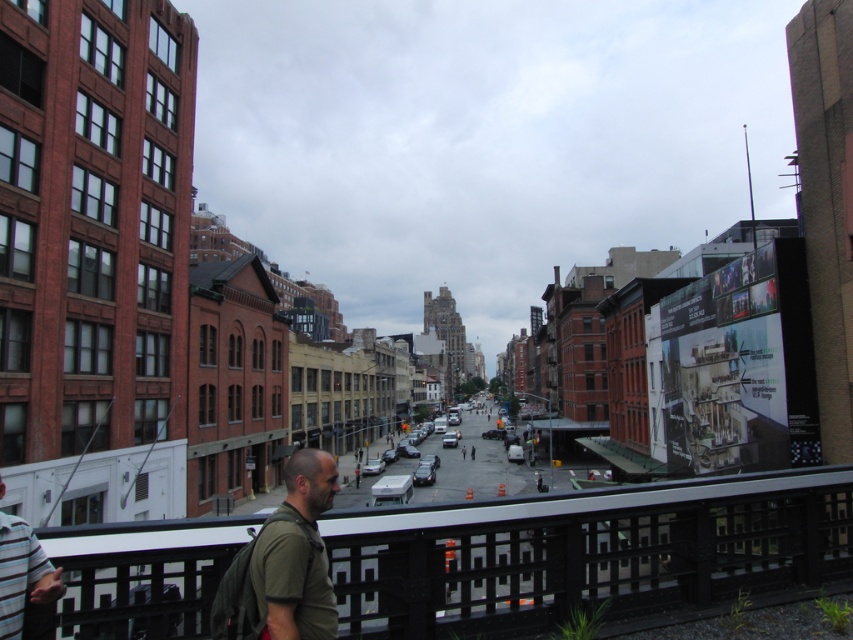
Question: Which of the following is the closest to the observer?

Choices:
 (A) (252, 518)
 (B) (59, 586)
 (C) (325, 452)

Answer: (B)

Question: Which object is positioned farthest from the black metal rail at lower center?

Choices:
 (A) green matte shirt at lower center
 (B) striped cotton shirt at lower left

Answer: (B)

Question: Does black metal rail at lower center have a smaller size compared to green matte shirt at lower center?

Choices:
 (A) no
 (B) yes

Answer: (B)

Question: Which object is closer to the camera taking this photo?

Choices:
 (A) black metal rail at lower center
 (B) striped cotton shirt at lower left

Answer: (B)

Question: Is black metal rail at lower center thinner than green matte shirt at lower center?

Choices:
 (A) yes
 (B) no

Answer: (B)

Question: Observing the image, what is the correct spatial positioning of black metal rail at lower center in reference to green matte shirt at lower center?

Choices:
 (A) left
 (B) right

Answer: (B)